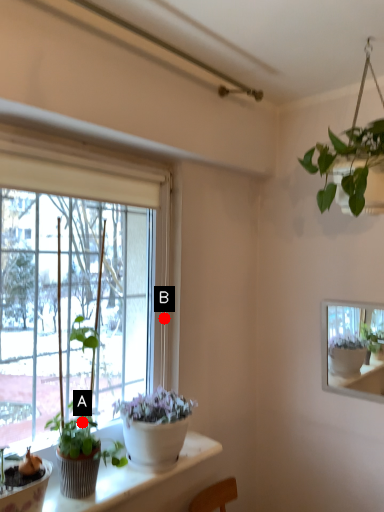
Question: Two points are circled on the image, labeled by A and B beside each circle. Which point is closer to the camera taking this photo?

Choices:
 (A) A is closer
 (B) B is closer

Answer: (A)